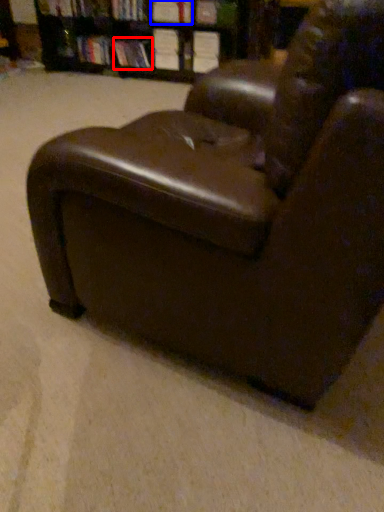
Question: Which object appears closest to the camera in this image, book (highlighted by a red box) or book (highlighted by a blue box)?

Choices:
 (A) book
 (B) book

Answer: (B)